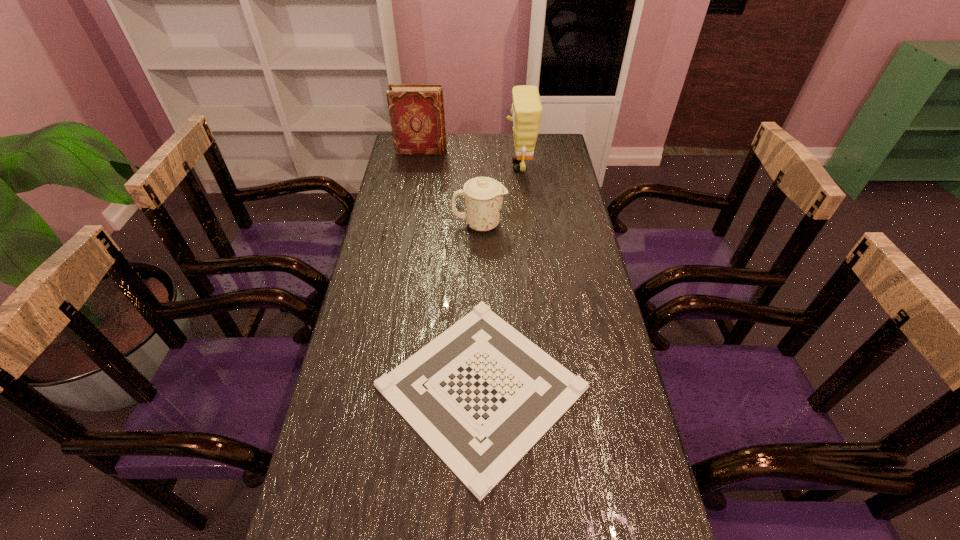
This screenshot has width=960, height=540. Find the location of `sponge`. sponge is located at coordinates (526, 110).

You are a GUI agent. You are given a task and a screenshot of the screen. Output one action in this format:
    pyautogui.click(x=<x>, y=<y>)
    Task: Click on the hardback book
    This screenshot has width=960, height=540.
    Given the screenshot: What is the action you would take?
    pyautogui.click(x=416, y=111)

You are a GUI agent. You are given a task and a screenshot of the screen. Output one action in this format:
    pyautogui.click(x=<x>, y=<y>)
    Task: Click on the chinaware
    
    Given the screenshot: What is the action you would take?
    pyautogui.click(x=483, y=196)

Find the location of a particular element. The width and height of the screenshot is (960, 540). the second shortest object is located at coordinates click(x=483, y=196).

Where is `checkerboard`? The height and width of the screenshot is (540, 960). checkerboard is located at coordinates (481, 395).

Find the location of a particular element. This screenshot has width=960, height=540. the shortest object is located at coordinates (481, 395).

At what (x,y) coordinates should I click in order to perform the action: click on vacant space located 0.110m on the face of the sponge. Please return your answer as a coordinate pair (x, y). The width and height of the screenshot is (960, 540). Looking at the image, I should click on (478, 166).

The image size is (960, 540). What are the coordinates of `vacant space situated on the face of the sponge` in the screenshot? It's located at (472, 166).

You are a GUI agent. You are given a task and a screenshot of the screen. Output one action in this format:
    pyautogui.click(x=<x>, y=<y>)
    Task: Click on the free space located 0.150m on the face of the sponge
    
    Given the screenshot: What is the action you would take?
    click(x=468, y=166)

Locate an element on the screen. This screenshot has width=960, height=540. free location located 0.130m on the spine side of the hardback book is located at coordinates (477, 151).